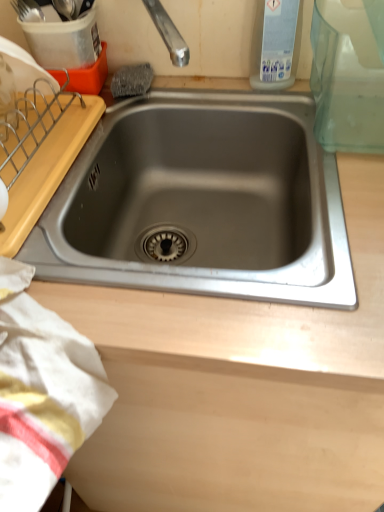
Question: From the image's perspective, is white cotton towel at lower left on top of stainless steel sink at center?

Choices:
 (A) no
 (B) yes

Answer: (A)

Question: Does white cotton towel at lower left contain stainless steel sink at center?

Choices:
 (A) yes
 (B) no

Answer: (B)

Question: Is white cotton towel at lower left at the left side of stainless steel sink at center?

Choices:
 (A) yes
 (B) no

Answer: (A)

Question: Is white cotton towel at lower left oriented away from stainless steel sink at center?

Choices:
 (A) yes
 (B) no

Answer: (B)

Question: Is white cotton towel at lower left wider than stainless steel sink at center?

Choices:
 (A) yes
 (B) no

Answer: (B)

Question: Is white cotton towel at lower left positioned beyond the bounds of stainless steel sink at center?

Choices:
 (A) yes
 (B) no

Answer: (A)

Question: Can you confirm if stainless steel sink at center is shorter than white cotton towel at lower left?

Choices:
 (A) no
 (B) yes

Answer: (A)

Question: Is the position of stainless steel sink at center more distant than that of white cotton towel at lower left?

Choices:
 (A) yes
 (B) no

Answer: (A)

Question: Is stainless steel sink at center bigger than white cotton towel at lower left?

Choices:
 (A) yes
 (B) no

Answer: (A)

Question: Considering the relative sizes of stainless steel sink at center and white cotton towel at lower left in the image provided, is stainless steel sink at center taller than white cotton towel at lower left?

Choices:
 (A) no
 (B) yes

Answer: (B)

Question: From the image's perspective, is stainless steel sink at center on white cotton towel at lower left?

Choices:
 (A) no
 (B) yes

Answer: (B)

Question: Is stainless steel sink at center oriented towards white cotton towel at lower left?

Choices:
 (A) yes
 (B) no

Answer: (A)

Question: From the image's perspective, is transparent plastic bottle at upper right above white cotton towel at lower left?

Choices:
 (A) yes
 (B) no

Answer: (A)